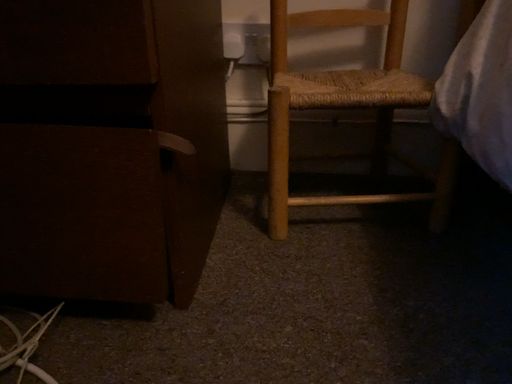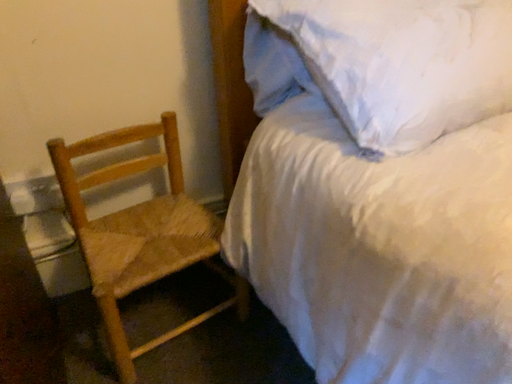
Question: Which way did the camera rotate in the video?

Choices:
 (A) rotated left
 (B) rotated right

Answer: (B)